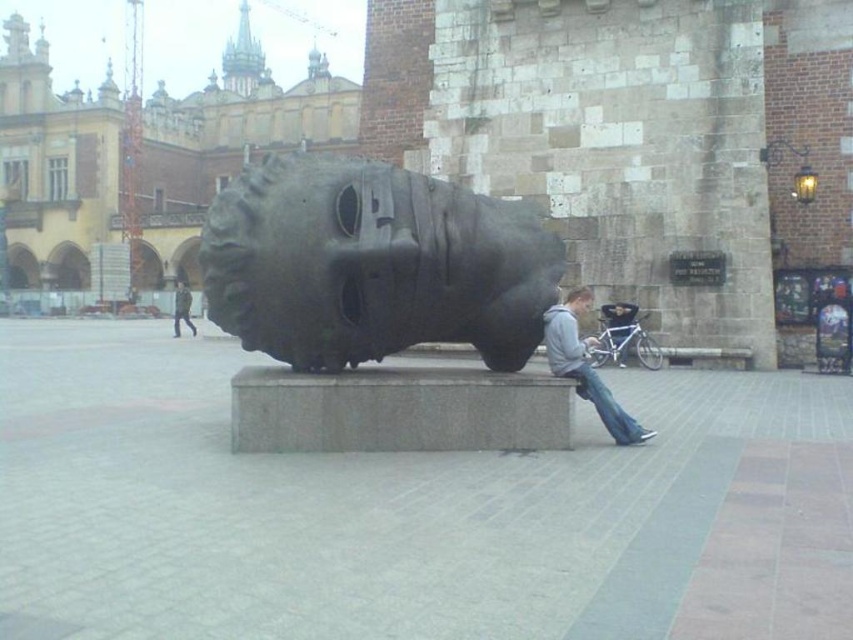
Question: Which point is closer to the camera?

Choices:
 (A) (318, 250)
 (B) (184, 312)
 (C) (639, 435)

Answer: (A)

Question: Is the position of blue denim jeans at lower center less distant than that of dark gray metallic sculpture at center?

Choices:
 (A) no
 (B) yes

Answer: (B)

Question: Is bronze textured sculpture at center thinner than gray hoodie at center?

Choices:
 (A) yes
 (B) no

Answer: (B)

Question: Is the position of gray hoodie at center less distant than that of dark gray metallic sculpture at center?

Choices:
 (A) yes
 (B) no

Answer: (A)

Question: Which object is positioned farthest from the dark gray metallic sculpture at center?

Choices:
 (A) gray hoodie at center
 (B) bronze textured sculpture at center

Answer: (A)

Question: Considering the real-world distances, which object is farthest from the gray hoodie at center?

Choices:
 (A) bronze textured sculpture at center
 (B) dark gray metallic sculpture at center
 (C) blue denim jeans at lower center

Answer: (B)